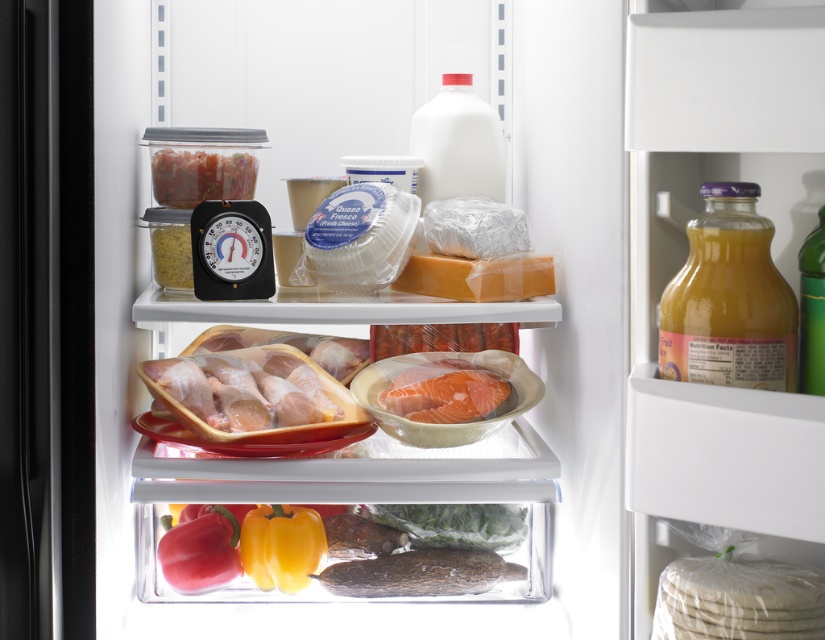
Is translucent plastic tortillas at lower right positioned in front of pinkish translucent salmon at center?

Yes, translucent plastic tortillas at lower right is closer to the viewer.

Where is `translucent plastic tortillas at lower right`? The image size is (825, 640). translucent plastic tortillas at lower right is located at coordinates (738, 598).

Image resolution: width=825 pixels, height=640 pixels. I want to click on translucent plastic tortillas at lower right, so click(x=738, y=598).

Can you confirm if pinkish translucent salmon at center is bigger than smooth red pepper at lower left?

Yes.

Consider the image. Who is shorter, pinkish translucent salmon at center or smooth red pepper at lower left?

Standing shorter between the two is pinkish translucent salmon at center.

Is point (397, 400) positioned before point (205, 522)?

Yes, it is in front of point (205, 522).

Find the location of a particular element. pinkish translucent salmon at center is located at coordinates (446, 396).

Can you confirm if green leafy vegetables at bottom is taller than pinkish translucent salmon at center?

Yes, green leafy vegetables at bottom is taller than pinkish translucent salmon at center.

Identify the location of green leafy vegetables at bottom. The width and height of the screenshot is (825, 640). (453, 524).

At what (x,y) coordinates should I click in order to perform the action: click on green leafy vegetables at bottom. Please return your answer as a coordinate pair (x, y). The width and height of the screenshot is (825, 640). Looking at the image, I should click on (453, 524).